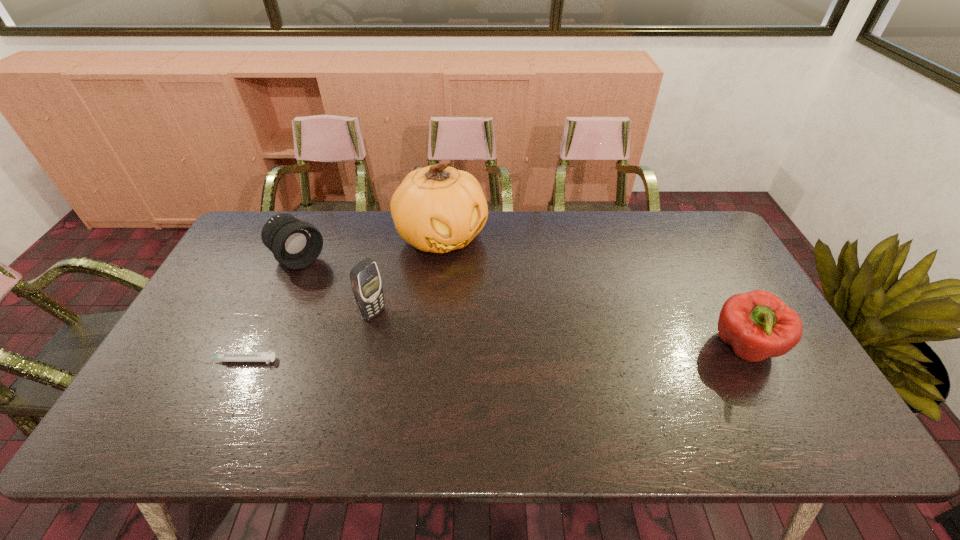
Find the location of `free space located on the front face of the cellular telephone`. free space located on the front face of the cellular telephone is located at coordinates (439, 352).

Where is `vacant area located 0.070m on the front face of the cellular telephone`? vacant area located 0.070m on the front face of the cellular telephone is located at coordinates (401, 330).

Image resolution: width=960 pixels, height=540 pixels. I want to click on vacant space located on the front face of the cellular telephone, so click(439, 352).

Find the location of a particular element. This screenshot has width=960, height=540. free location located on the front face of the pumpkin is located at coordinates (475, 278).

Identify the location of vacant space located on the front face of the pumpkin. This screenshot has width=960, height=540. (486, 291).

At what (x,y) coordinates should I click in order to perform the action: click on vacant space positioned on the front face of the pumpkin. Please return your answer as a coordinate pair (x, y). Looking at the image, I should click on [x=496, y=303].

Find the location of `telephoto lens located in the far edge section of the desktop`. telephoto lens located in the far edge section of the desktop is located at coordinates (296, 244).

Identify the location of pumpkin that is at the far edge. (438, 209).

Locate an element on the screen. The width and height of the screenshot is (960, 540). object at the near edge is located at coordinates (758, 325).

This screenshot has height=540, width=960. Identify the location of syringe located at the left edge. (268, 356).